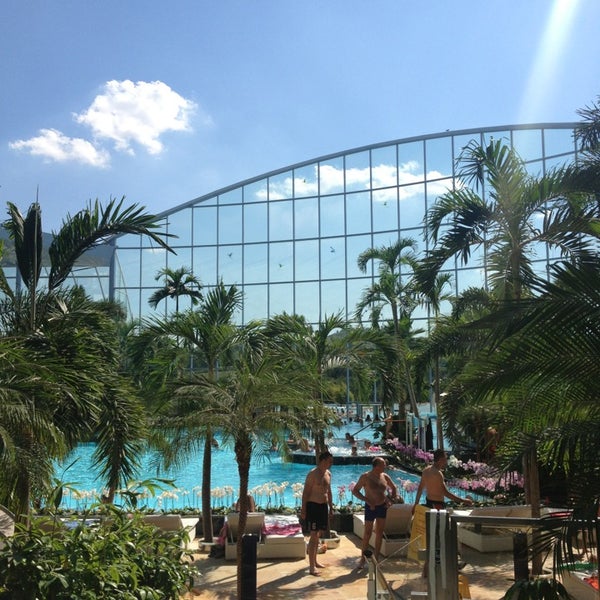
Locate an element on the screen. floor is located at coordinates (321, 584).